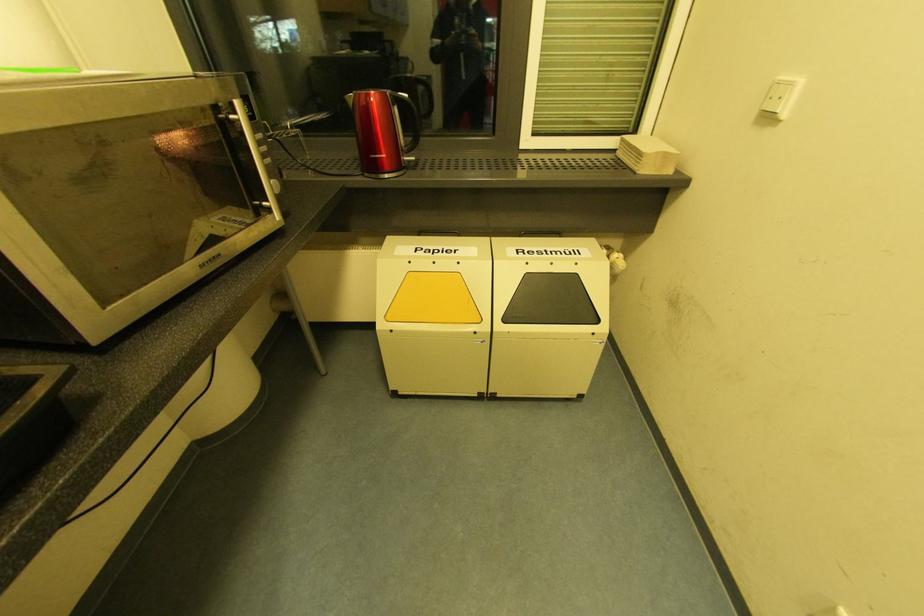
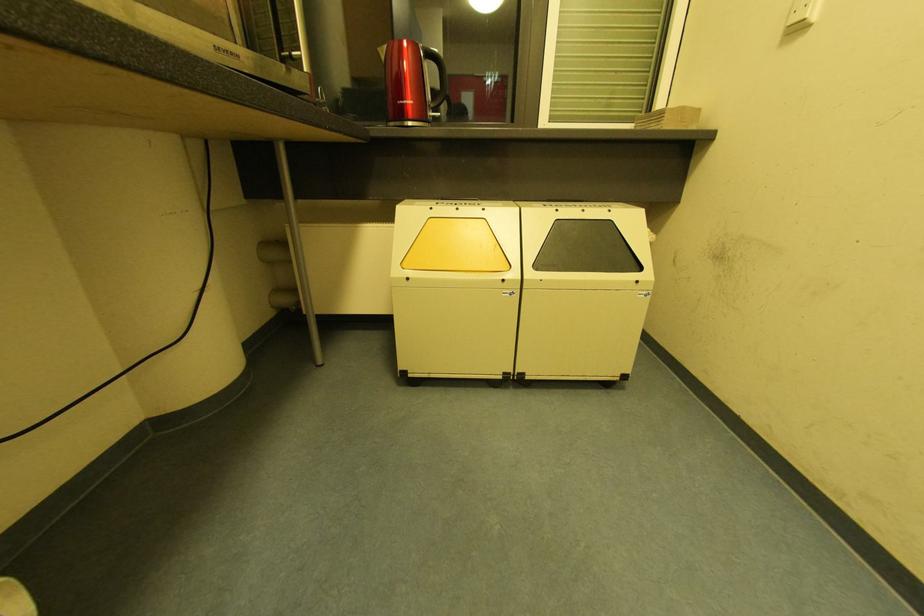
Question: How did the camera likely rotate?

Choices:
 (A) Left
 (B) Right
 (C) Up
 (D) Down

Answer: (C)